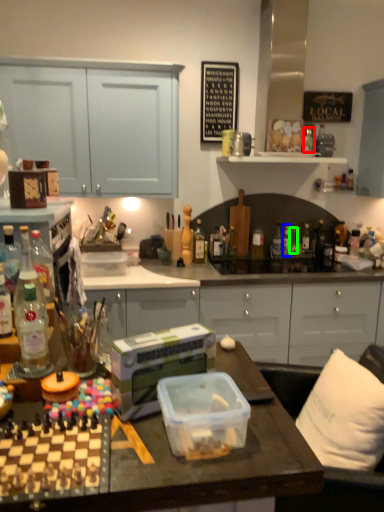
Question: Which is nearer to the bottle (highlighted by a red box)? bottle (highlighted by a blue box) or bottle (highlighted by a green box).

Choices:
 (A) bottle
 (B) bottle

Answer: (A)